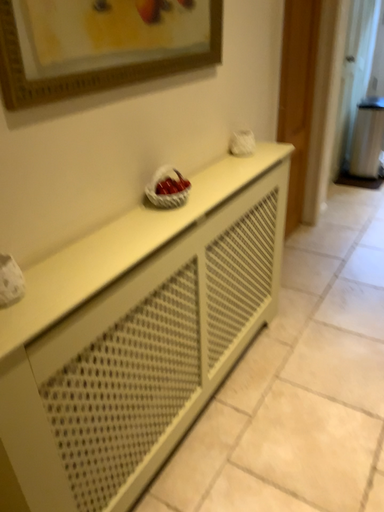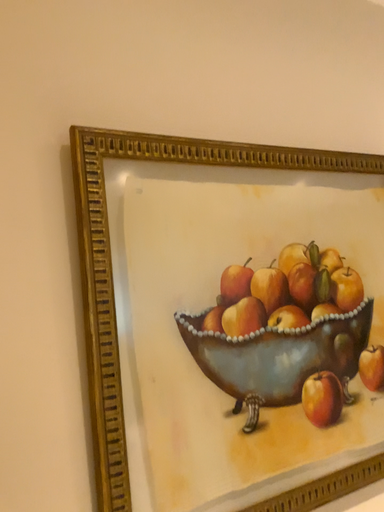
Question: Which way did the camera rotate in the video?

Choices:
 (A) rotated right
 (B) rotated left

Answer: (B)